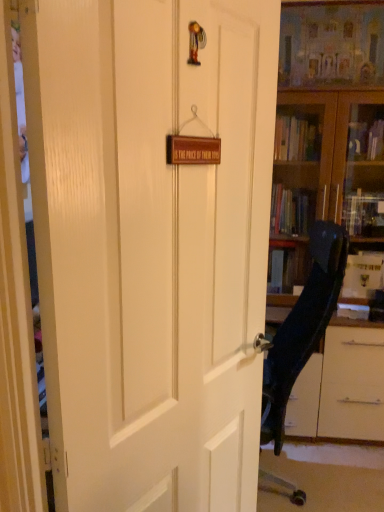
Question: Does black plastic chair at right have a lesser height compared to wooden book at center?

Choices:
 (A) no
 (B) yes

Answer: (A)

Question: Can you confirm if black plastic chair at right is wider than wooden book at center?

Choices:
 (A) yes
 (B) no

Answer: (A)

Question: Would you say black plastic chair at right is a long distance from wooden book at center?

Choices:
 (A) no
 (B) yes

Answer: (A)

Question: Considering the relative sizes of black plastic chair at right and wooden book at center in the image provided, is black plastic chair at right thinner than wooden book at center?

Choices:
 (A) yes
 (B) no

Answer: (B)

Question: Can you confirm if black plastic chair at right is taller than wooden book at center?

Choices:
 (A) yes
 (B) no

Answer: (A)

Question: Is black plastic chair at right at the left side of wooden book at center?

Choices:
 (A) no
 (B) yes

Answer: (B)

Question: Can you confirm if wooden book at center is shorter than black plastic chair at right?

Choices:
 (A) no
 (B) yes

Answer: (B)

Question: From the image's perspective, would you say wooden book at center is positioned over black plastic chair at right?

Choices:
 (A) yes
 (B) no

Answer: (A)

Question: Can you confirm if wooden book at center is positioned to the left of black plastic chair at right?

Choices:
 (A) yes
 (B) no

Answer: (B)

Question: Does wooden book at center turn towards black plastic chair at right?

Choices:
 (A) yes
 (B) no

Answer: (A)

Question: From the image's perspective, is wooden book at center located beneath black plastic chair at right?

Choices:
 (A) no
 (B) yes

Answer: (A)

Question: Considering the relative sizes of wooden book at center and black plastic chair at right in the image provided, is wooden book at center taller than black plastic chair at right?

Choices:
 (A) yes
 (B) no

Answer: (B)

Question: Considering the relative sizes of black plastic chair at right and wooden bookcase at right in the image provided, is black plastic chair at right smaller than wooden bookcase at right?

Choices:
 (A) yes
 (B) no

Answer: (A)